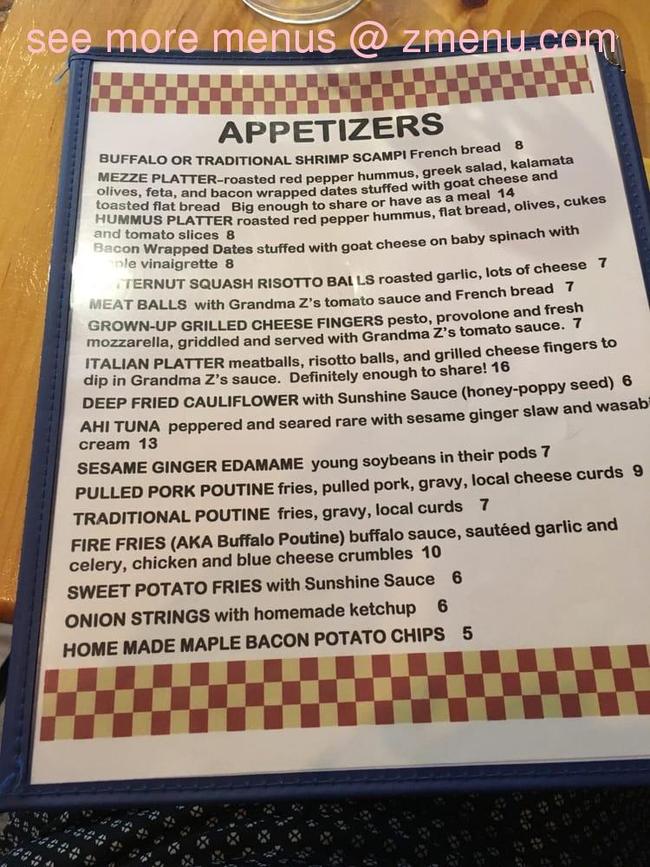
The height and width of the screenshot is (867, 650). I want to click on glare from light, so click(x=95, y=277).